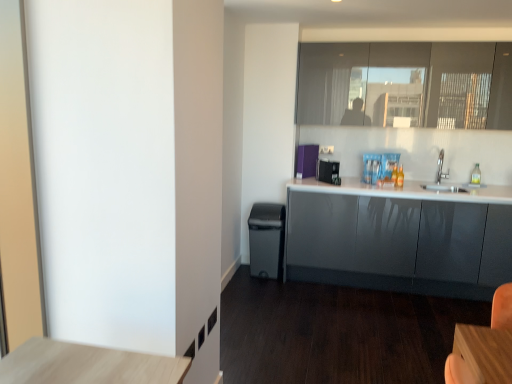
Where is `free space in front of matte black trash can at lower center`? The height and width of the screenshot is (384, 512). free space in front of matte black trash can at lower center is located at coordinates (263, 283).